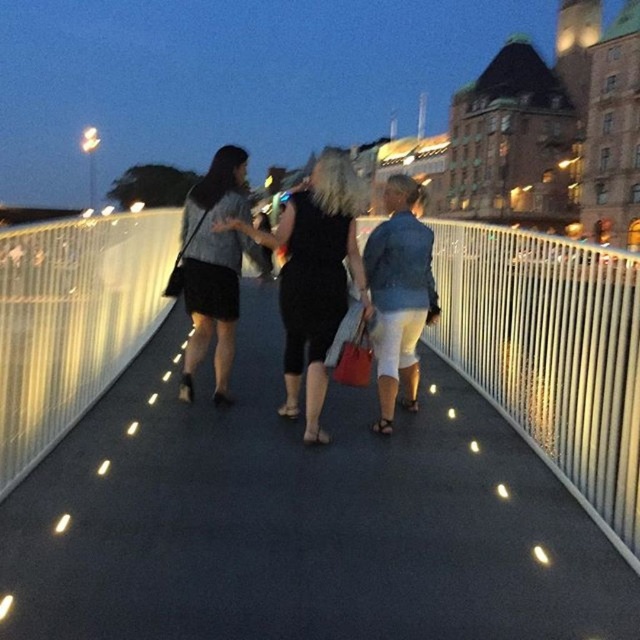
Who is taller, black matte dress at center or matte black dress at center?

Standing taller between the two is matte black dress at center.

The width and height of the screenshot is (640, 640). I want to click on black matte dress at center, so click(x=314, y=276).